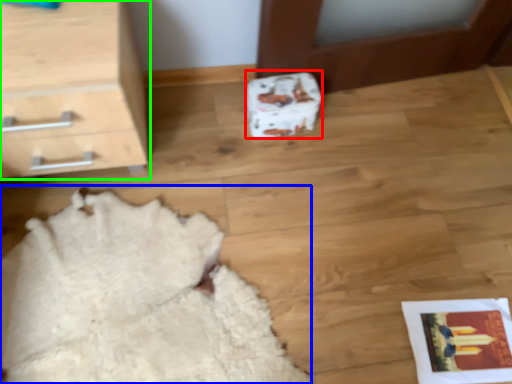
Question: Which object is positioned closest to shoe box (highlighted by a red box)? Select from blanket (highlighted by a blue box) and chest of drawers (highlighted by a green box).

Choices:
 (A) blanket
 (B) chest of drawers

Answer: (B)